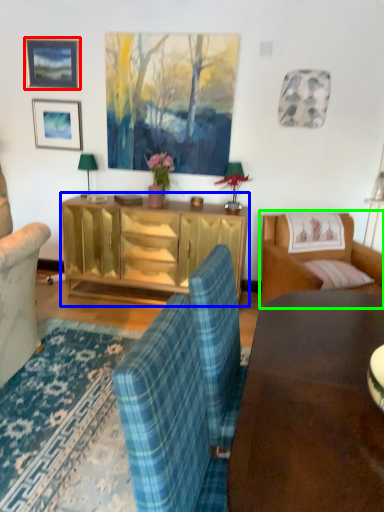
Question: Which object is positioned farthest from picture frame (highlighted by a red box)? Select from cabinetry (highlighted by a blue box) and studio couch (highlighted by a green box).

Choices:
 (A) cabinetry
 (B) studio couch

Answer: (B)